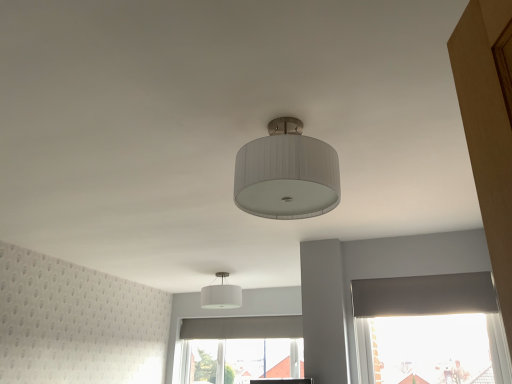
Question: Considering the relative sizes of transparent plastic window screen at lower right and white textured lampshade at center, the 1th lamp in the front-to-back sequence, in the image provided, is transparent plastic window screen at lower right thinner than white textured lampshade at center, the 1th lamp in the front-to-back sequence,?

Choices:
 (A) yes
 (B) no

Answer: (A)

Question: Could you tell me if transparent plastic window screen at lower right is facing white textured lampshade at center, which is the first lamp from right to left?

Choices:
 (A) yes
 (B) no

Answer: (A)

Question: Does transparent plastic window screen at lower right have a lesser height compared to white textured lampshade at center, acting as the 1th lamp starting from the top?

Choices:
 (A) no
 (B) yes

Answer: (A)

Question: From the image's perspective, is transparent plastic window screen at lower right above white textured lampshade at center, the 1th lamp in the front-to-back sequence?

Choices:
 (A) no
 (B) yes

Answer: (A)

Question: Considering the relative positions of transparent plastic window screen at lower right and white textured lampshade at center, the 1th lamp in the front-to-back sequence, in the image provided, is transparent plastic window screen at lower right to the left of white textured lampshade at center, the 1th lamp in the front-to-back sequence, from the viewer's perspective?

Choices:
 (A) yes
 (B) no

Answer: (B)

Question: In the image, is white fabric lampshade at center, which ranks as the 1th lamp in left-to-right order, on the left side or the right side of transparent plastic window screen at lower right?

Choices:
 (A) right
 (B) left

Answer: (B)

Question: In terms of size, does white fabric lampshade at center, which ranks as the 1th lamp in left-to-right order, appear bigger or smaller than transparent plastic window screen at lower right?

Choices:
 (A) big
 (B) small

Answer: (B)

Question: In terms of width, does white fabric lampshade at center, which is the second lamp from top to bottom, look wider or thinner when compared to transparent plastic window screen at lower right?

Choices:
 (A) thin
 (B) wide

Answer: (B)

Question: In the image, is white fabric lampshade at center, acting as the second lamp starting from the right, positioned in front of or behind transparent plastic window screen at lower right?

Choices:
 (A) front
 (B) behind

Answer: (B)

Question: Which is correct: white textured lampshade at center, the 1th lamp in the front-to-back sequence, is inside white fabric lampshade at center, acting as the second lamp starting from the right, or outside of it?

Choices:
 (A) inside
 (B) outside

Answer: (B)

Question: From a real-world perspective, relative to white fabric lampshade at center, which ranks as the 1th lamp in left-to-right order, is white textured lampshade at center, which is the first lamp from right to left, vertically above or below?

Choices:
 (A) above
 (B) below

Answer: (B)

Question: From the image's perspective, is white textured lampshade at center, the 1th lamp in the front-to-back sequence, located above or below white fabric lampshade at center, acting as the second lamp starting from the right?

Choices:
 (A) below
 (B) above

Answer: (B)

Question: Considering the relative positions of white textured lampshade at center, arranged as the second lamp when viewed from the left, and white fabric lampshade at center, acting as the second lamp starting from the right, in the image provided, is white textured lampshade at center, arranged as the second lamp when viewed from the left, to the left or to the right of white fabric lampshade at center, acting as the second lamp starting from the right,?

Choices:
 (A) left
 (B) right

Answer: (B)

Question: In the image, is white textured lampshade at center, the 1th lamp in the front-to-back sequence, positioned in front of or behind transparent plastic window screen at lower right?

Choices:
 (A) front
 (B) behind

Answer: (A)

Question: Choose the correct answer: Is white textured lampshade at center, the second lamp viewed from the back, inside transparent plastic window screen at lower right or outside it?

Choices:
 (A) inside
 (B) outside

Answer: (B)